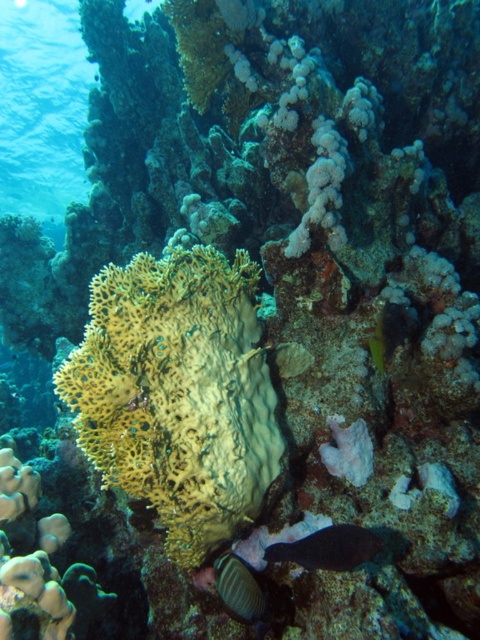
Question: Does smooth dark blue fish at lower center have a lesser width compared to shiny brown fish at lower center?

Choices:
 (A) yes
 (B) no

Answer: (B)

Question: Which point is closer to the camera taking this photo?

Choices:
 (A) (214, 564)
 (B) (335, 561)
 (C) (213, 474)

Answer: (B)

Question: Observing the image, what is the correct spatial positioning of smooth dark blue fish at lower center in reference to shiny brown fish at lower center?

Choices:
 (A) below
 (B) above

Answer: (B)

Question: Which point is farther to the camera?

Choices:
 (A) [103, 320]
 (B) [381, 544]

Answer: (A)

Question: Which of the following is the farthest from the observer?

Choices:
 (A) (352, 563)
 (B) (178, 468)
 (C) (242, 611)

Answer: (C)

Question: Does smooth dark blue fish at lower center have a lesser width compared to shiny brown fish at lower center?

Choices:
 (A) no
 (B) yes

Answer: (A)